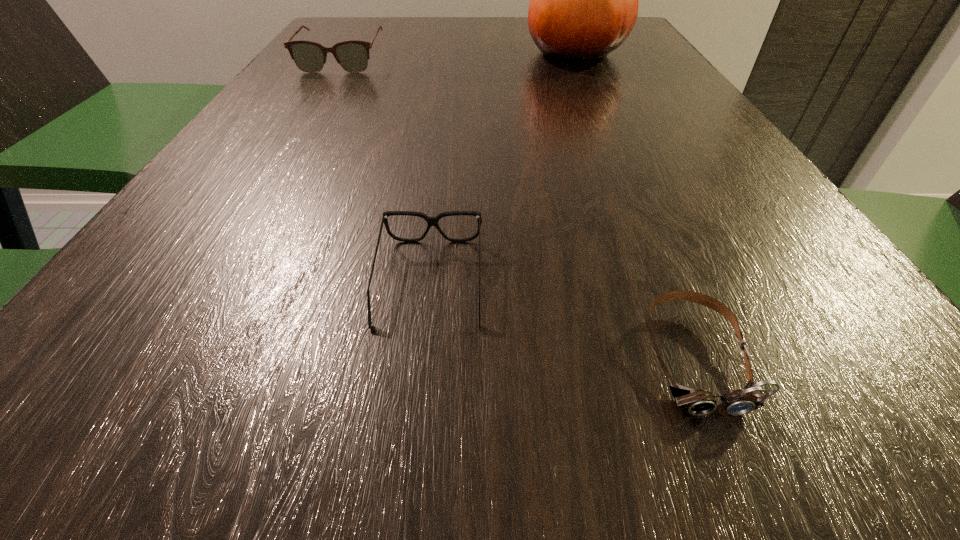
At what (x,y) coordinates should I click in order to perform the action: click on vacant area that lies between the shortest object and the taller spectacles. Please return your answer as a coordinate pair (x, y). Looking at the image, I should click on (517, 208).

Where is `object that stands as the closest to the taller spectacles`? The width and height of the screenshot is (960, 540). object that stands as the closest to the taller spectacles is located at coordinates (584, 0).

Identify the location of the third closest object to the taller spectacles. (698, 402).